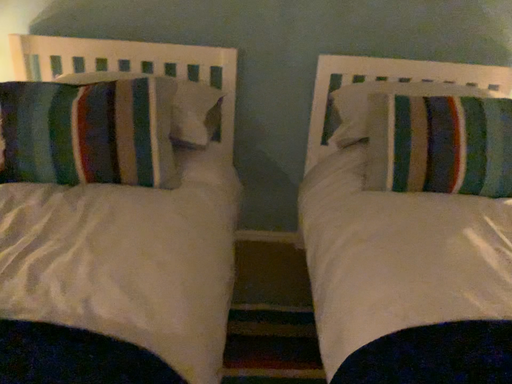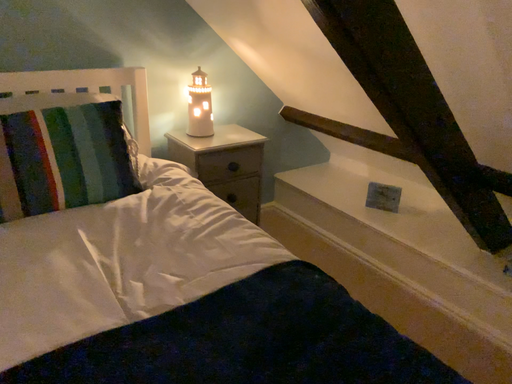
Question: How did the camera likely rotate when shooting the video?

Choices:
 (A) rotated left
 (B) rotated right

Answer: (B)